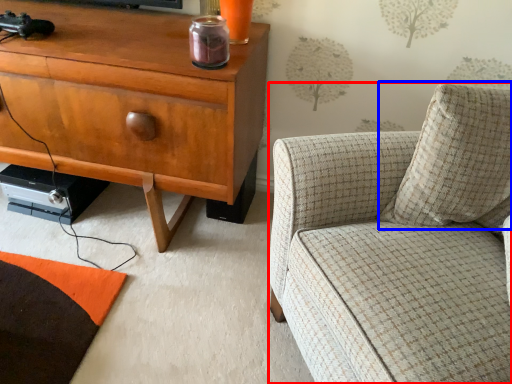
Question: Which point is closer to the camera, chair (highlighted by a red box) or pillow (highlighted by a blue box)?

Choices:
 (A) chair
 (B) pillow

Answer: (A)